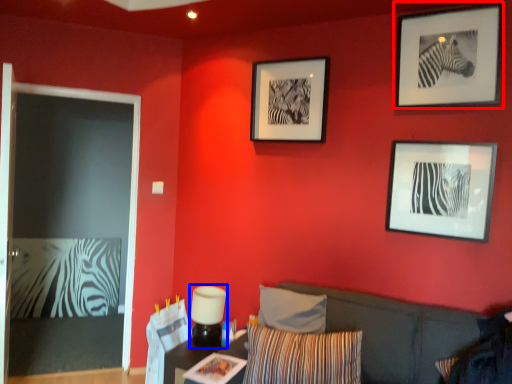
Question: Which of the following is the farthest to the observer, picture frame (highlighted by a red box) or lamp (highlighted by a blue box)?

Choices:
 (A) picture frame
 (B) lamp

Answer: (B)